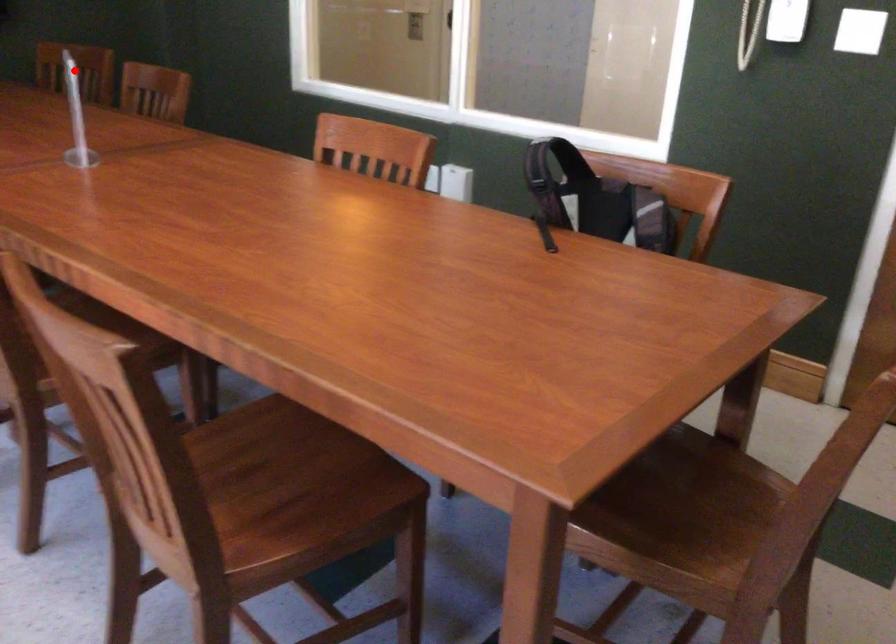
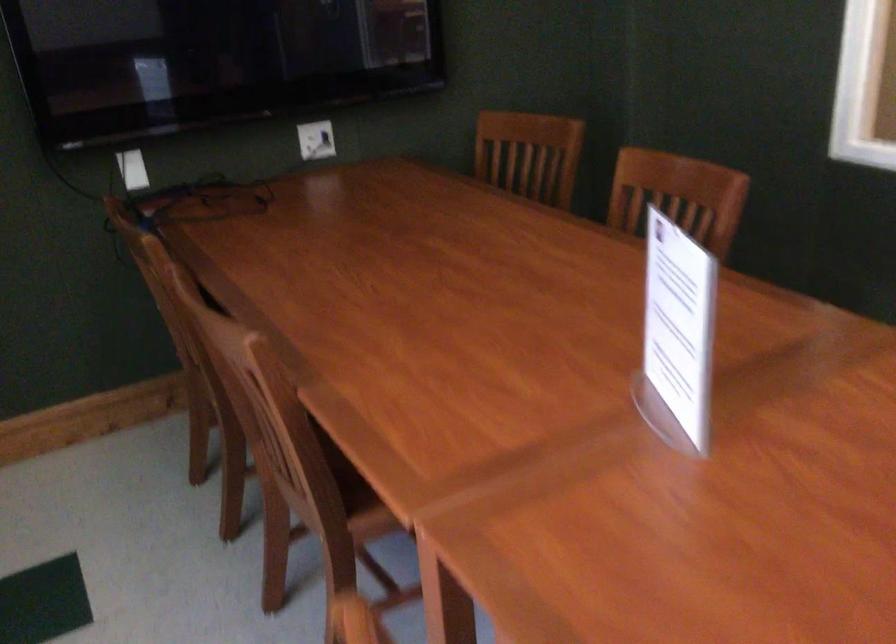
Question: I am providing you with two images of the same scene from different viewpoints. A red point is shown in image1. For the corresponding object point in image2, is it positioned nearer or farther from the camera?

Choices:
 (A) Nearer
 (B) Farther

Answer: (A)